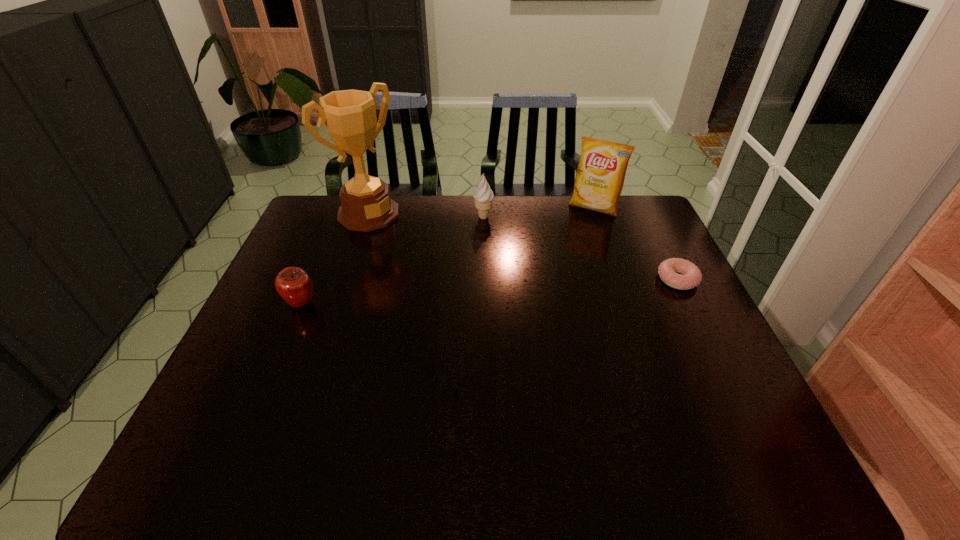
Locate an element on the screen. This screenshot has width=960, height=540. empty space between the fourth tallest object and the fourth object from left to right is located at coordinates (447, 255).

Identify the location of vacant area that lies between the third tallest object and the rightmost object. (581, 248).

This screenshot has height=540, width=960. In order to click on blank region between the second tallest object and the third object from right to left in this screenshot , I will do `click(539, 213)`.

At what (x,y) coordinates should I click in order to perform the action: click on vacant space that is in between the third object from right to left and the apple. Please return your answer as a coordinate pair (x, y). This screenshot has width=960, height=540. Looking at the image, I should click on (393, 260).

Locate an element on the screen. object identified as the second closest to the award is located at coordinates (295, 286).

Locate an element on the screen. object that is the fourth closest one to the shortest object is located at coordinates (295, 286).

Identify the location of vacant point that satisfies the following two spatial constraints: 1. on the front side of the shortest object; 2. on the left side of the fourth shortest object. (619, 279).

At what (x,y) coordinates should I click in order to perform the action: click on free space that satisfies the following two spatial constraints: 1. on the back side of the fourth tallest object; 2. on the right side of the doughnut. Please return your answer as a coordinate pair (x, y). This screenshot has height=540, width=960. Looking at the image, I should click on coord(311,279).